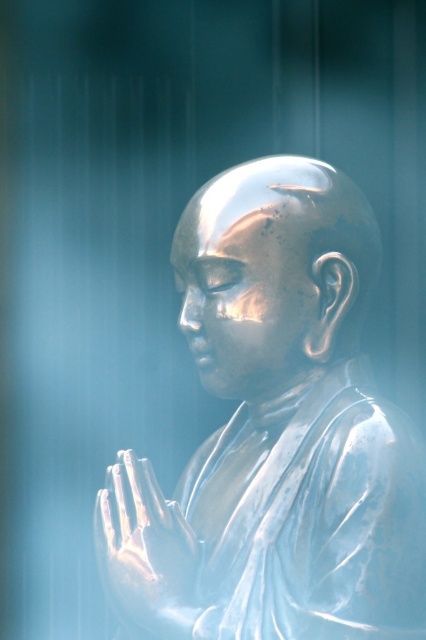
Which is behind, point (298, 465) or point (301, 348)?

Positioned behind is point (301, 348).

Does shiny silver monk at center appear over shiny metallic head at center?

No.

Image resolution: width=426 pixels, height=640 pixels. What are the coordinates of `shiny silver monk at center` in the screenshot? It's located at (275, 435).

Where is `shiny silver monk at center`? shiny silver monk at center is located at coordinates (275, 435).

This screenshot has width=426, height=640. What are the coordinates of `shiny silver monk at center` in the screenshot? It's located at (275, 435).

Between shiny silver monk at center and satin gold hands at center, which one is positioned lower?

Positioned lower is satin gold hands at center.

Is point (302, 547) positioned before point (178, 596)?

No, (302, 547) is behind (178, 596).

Where is `shiny silver monk at center`? This screenshot has width=426, height=640. shiny silver monk at center is located at coordinates (275, 435).

Can you confirm if shiny metallic head at center is positioned below satin gold hands at center?

No, shiny metallic head at center is not below satin gold hands at center.

Between shiny metallic head at center and satin gold hands at center, which one is positioned lower?

satin gold hands at center

What are the coordinates of `shiny metallic head at center` in the screenshot? It's located at (273, 273).

I want to click on shiny metallic head at center, so click(x=273, y=273).